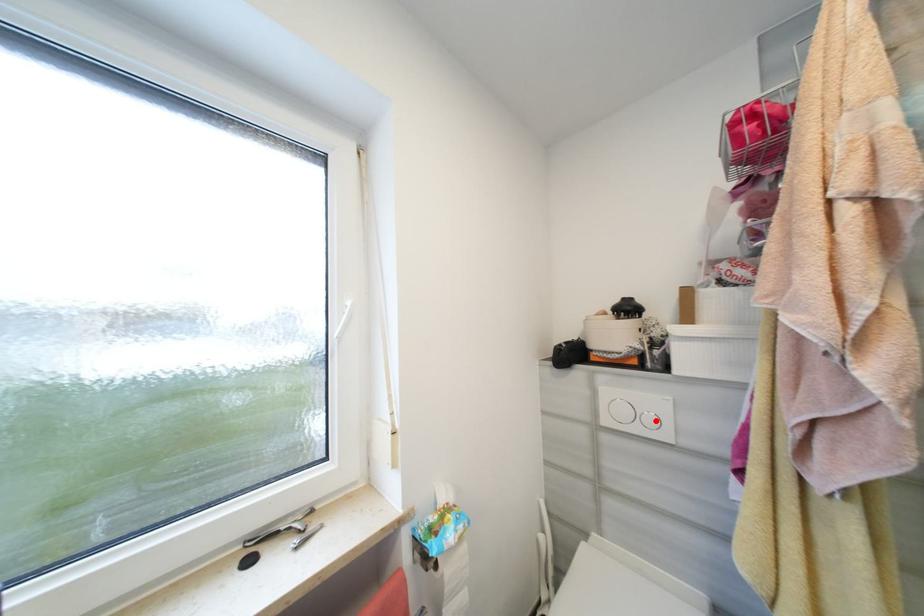
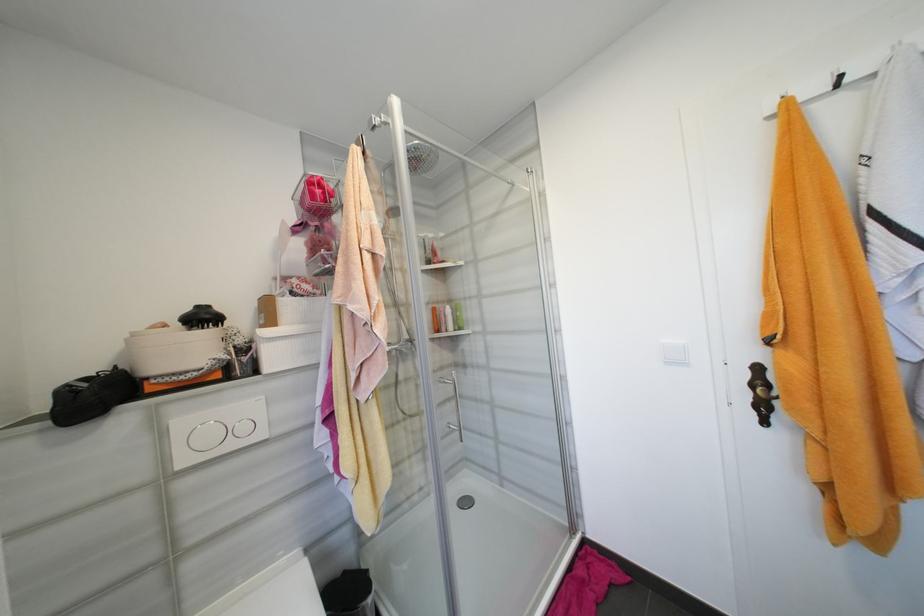
Question: I am providing you with two images of the same scene from different viewpoints. Given a red point in image1, look at the same physical point in image2. Is it:

Choices:
 (A) Closer to the viewpoint
 (B) Farther from the viewpoint

Answer: (A)